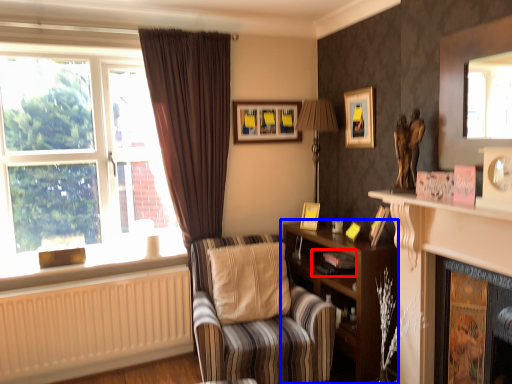
Question: Which point is further to the camera, book (highlighted by a red box) or shelf (highlighted by a blue box)?

Choices:
 (A) book
 (B) shelf

Answer: (A)